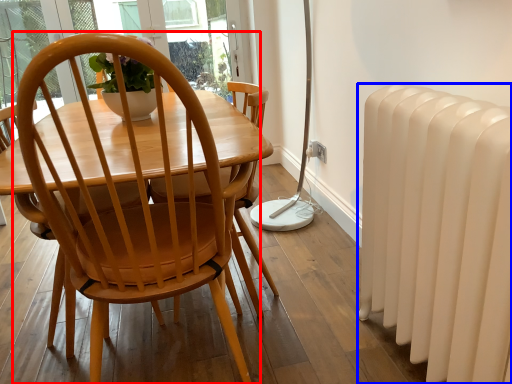
Question: Which object is further to the camera taking this photo, chair (highlighted by a red box) or radiator (highlighted by a blue box)?

Choices:
 (A) chair
 (B) radiator

Answer: (B)